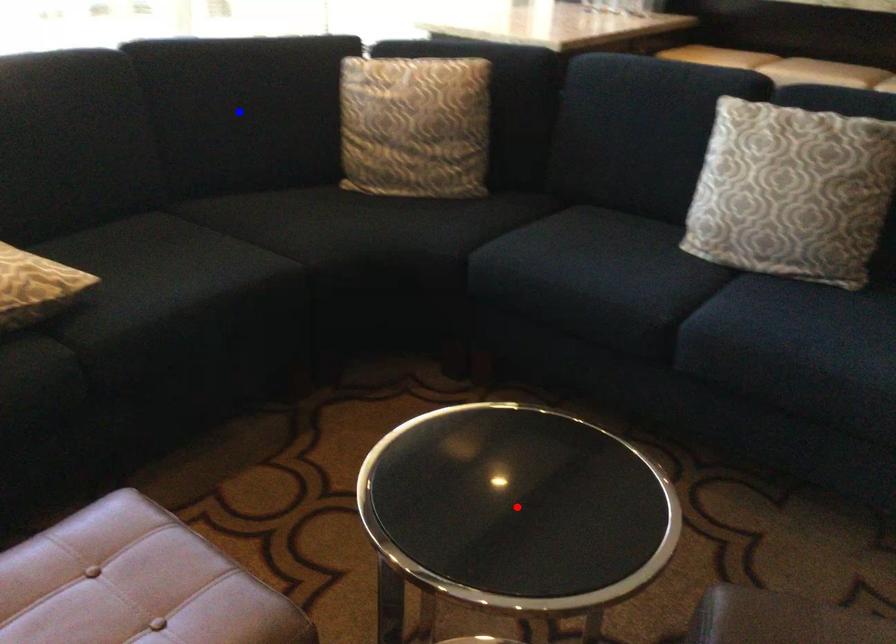
Question: Which of the two points in the image is closer to the camera?

Choices:
 (A) Blue point is closer.
 (B) Red point is closer.

Answer: (B)